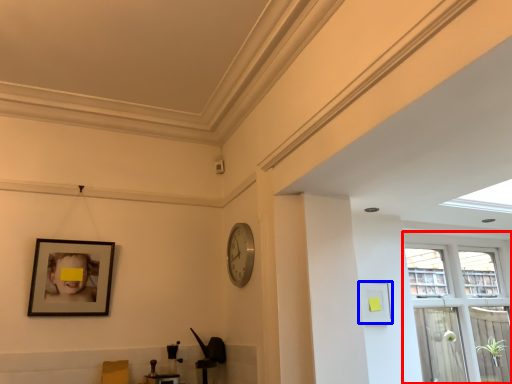
Question: Which of the following is the closest to the observer, window (highlighted by a red box) or picture frame (highlighted by a blue box)?

Choices:
 (A) window
 (B) picture frame

Answer: (B)